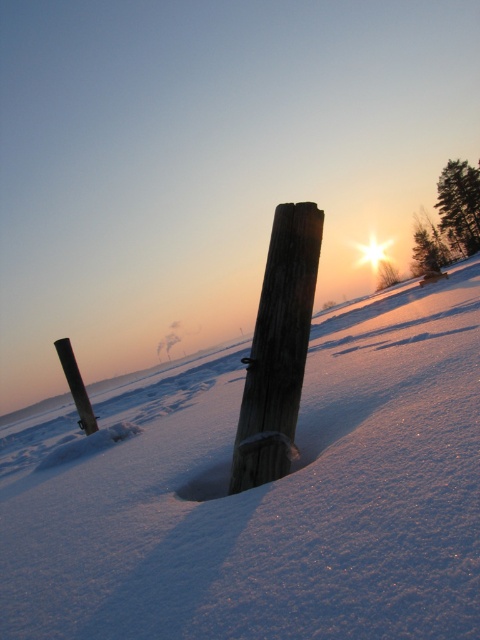
Question: Is white powdery snow at center below black wood post at lower left?

Choices:
 (A) yes
 (B) no

Answer: (B)

Question: Is white powdery snow at center further to the viewer compared to weathered wood post at center?

Choices:
 (A) yes
 (B) no

Answer: (B)

Question: Among these objects, which one is farthest from the camera?

Choices:
 (A) weathered wood post at center
 (B) black wood post at lower left

Answer: (B)

Question: Which object is closer to the camera taking this photo?

Choices:
 (A) weathered wood post at center
 (B) white powdery snow at center
 (C) black wood post at lower left

Answer: (B)

Question: Can you confirm if white powdery snow at center is wider than weathered wood post at center?

Choices:
 (A) no
 (B) yes

Answer: (B)

Question: Considering the real-world distances, which object is farthest from the weathered wood post at center?

Choices:
 (A) white powdery snow at center
 (B) black wood post at lower left

Answer: (B)